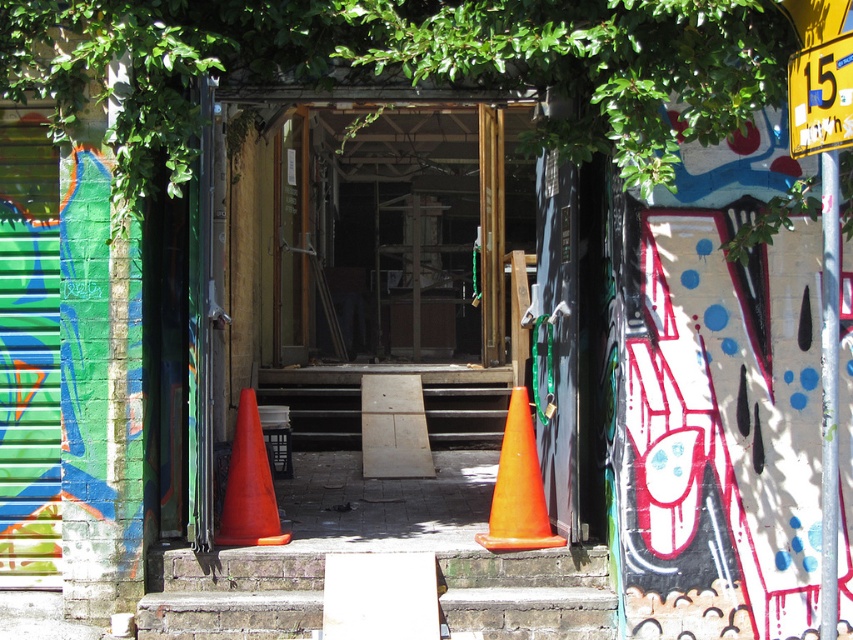
You are a painter standing at the entrance of the doorway. You want to paint both the green leafy tree at upper center and the orange matte traffic cone at center. Which object should you paint first to ensure proper perspective?

You should paint the green leafy tree at upper center first because it is closer to the viewer than the orange matte traffic cone at center, so it should be painted last to maintain proper perspective.

You are a photographer standing at the entrance of the doorway. You want to take a photo of the green leafy tree at upper center. Considering your current position, will you need to move closer or farther away to focus on the tree properly?

The green leafy tree at upper center is 4.53 meters away from the camera. Since the photographer is at the entrance, they should move closer to the tree to focus properly as the distance is quite far for a clear shot.

You are a delivery person trying to enter the doorway. You see a green leafy tree at upper center and an orange plastic traffic cone at center. Which object is closer to the left side of the doorway?

The green leafy tree at upper center is closer to the left side of the doorway because it is positioned to the left of the orange plastic traffic cone at center.